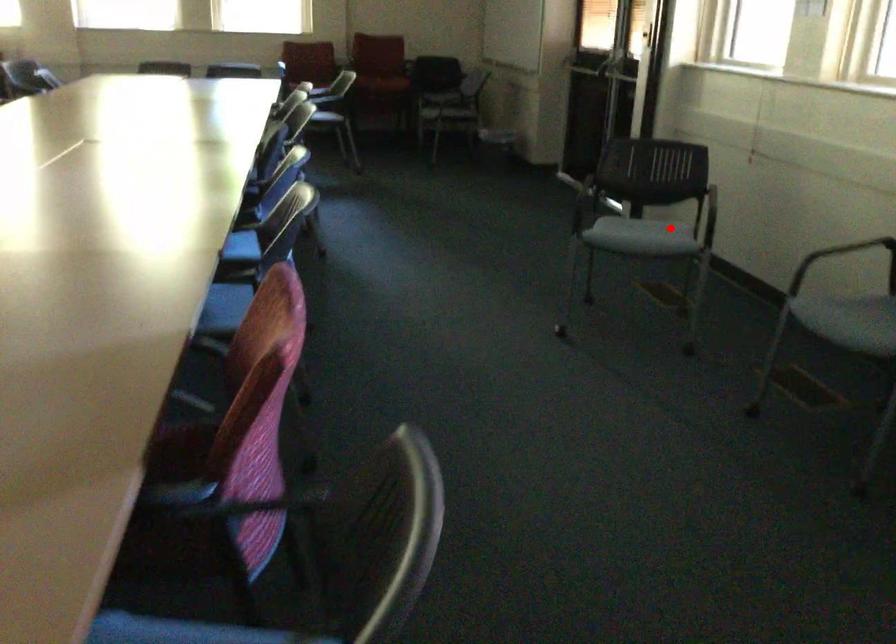
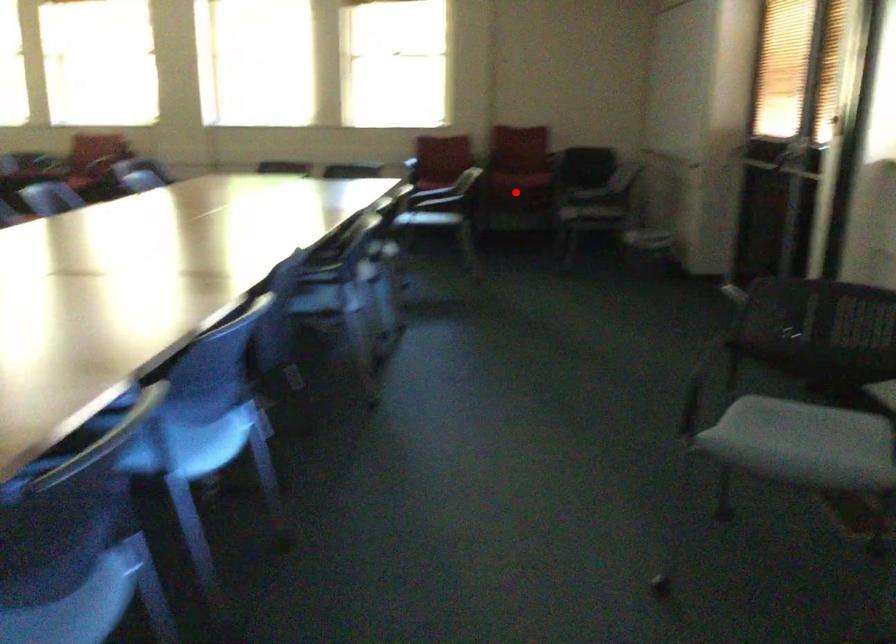
I am providing you with two images of the same scene from different viewpoints. A red point is marked on the first image and another point is marked on the second image. Is the red point in image1 aligned with the point shown in image2?

No